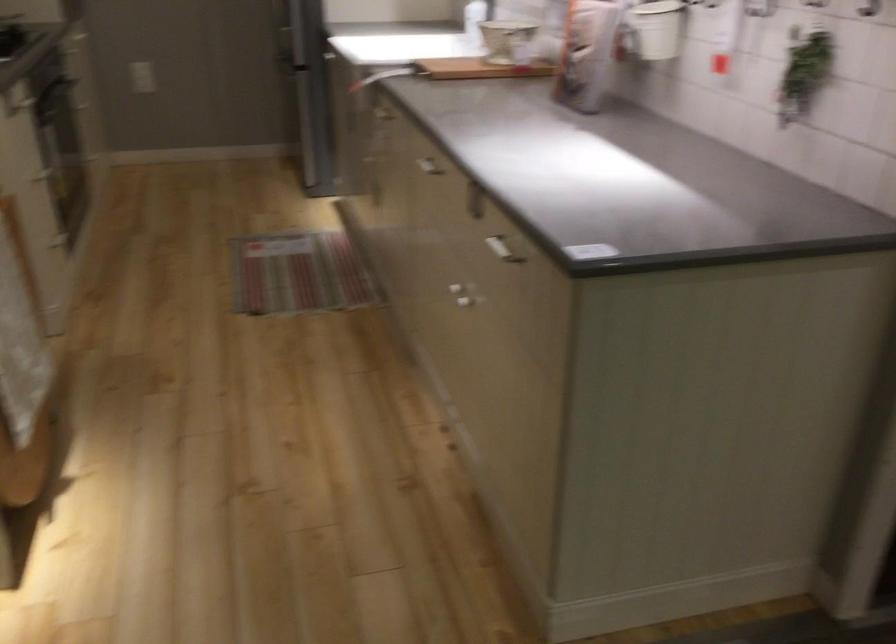
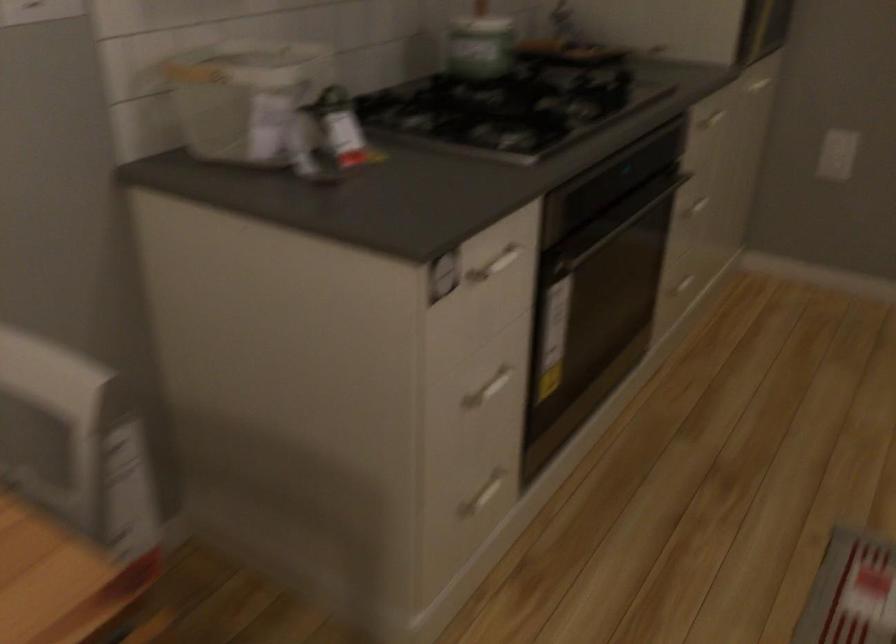
The point at (91, 111) is marked in the first image. Where is the corresponding point in the second image?

(694, 204)